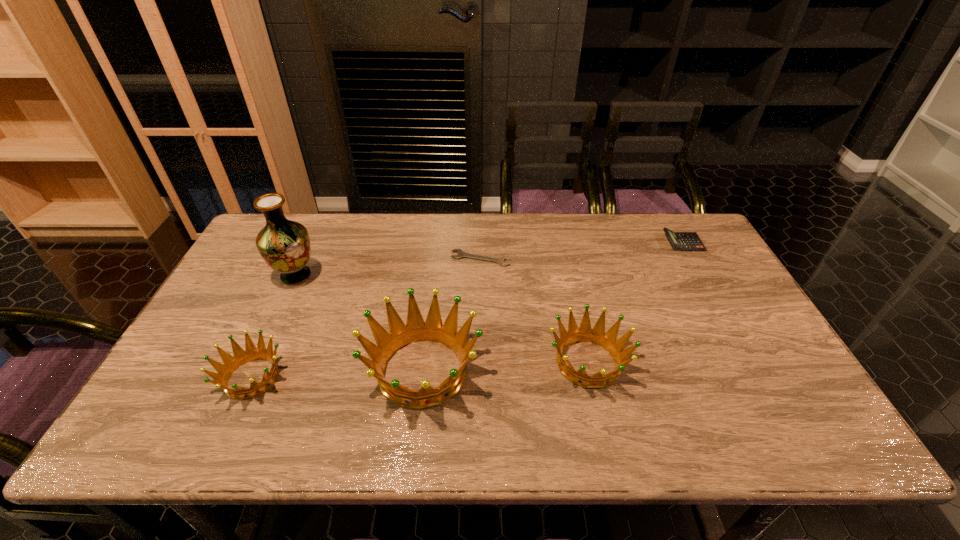
With all crowns evenly spaced, where should an extra crown be placed on the right to continue the pattern? Please point out a vacant space. Please provide its 2D coordinates. Your answer should be formatted as a tuple, i.e. [(x, y)], where the tuple contains the x and y coordinates of a point satisfying the conditions above.

[(749, 355)]